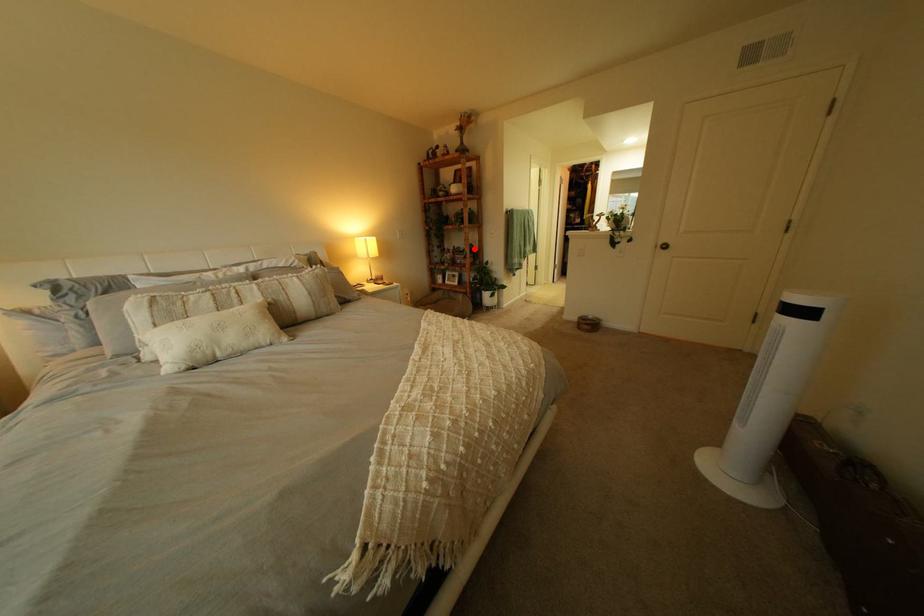
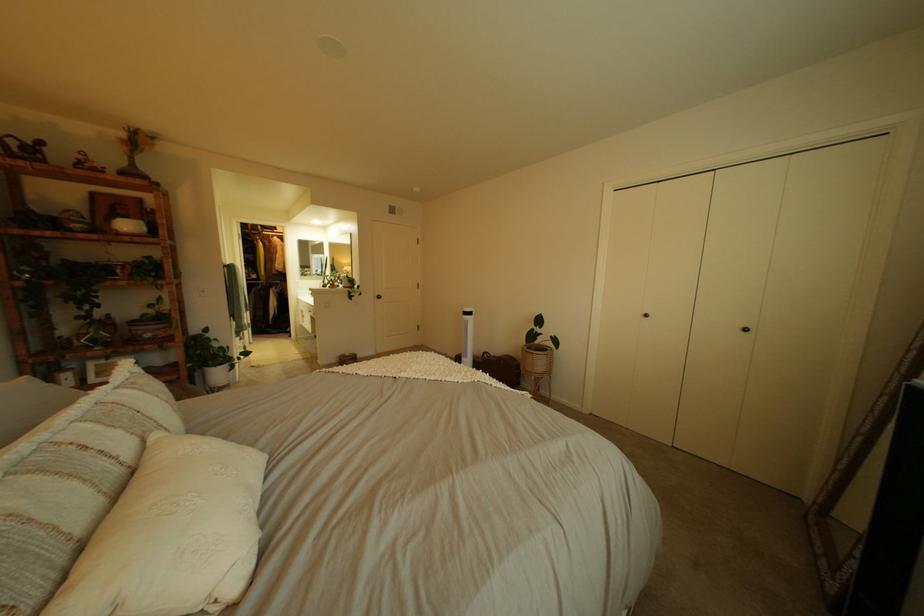
Question: I am providing you with two images of the same scene from different viewpoints. Given a red point in image1, look at the same physical point in image2. Is it:

Choices:
 (A) Closer to the viewpoint
 (B) Farther from the viewpoint

Answer: (B)